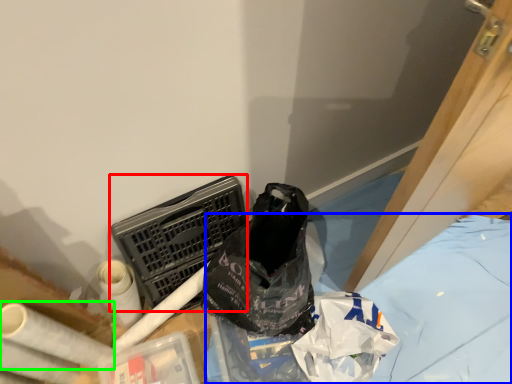
Question: Which object is the closest to the laundry basket (highlighted by a red box)? Choose among these: sheet (highlighted by a blue box) or toilet paper (highlighted by a green box).

Choices:
 (A) sheet
 (B) toilet paper

Answer: (B)